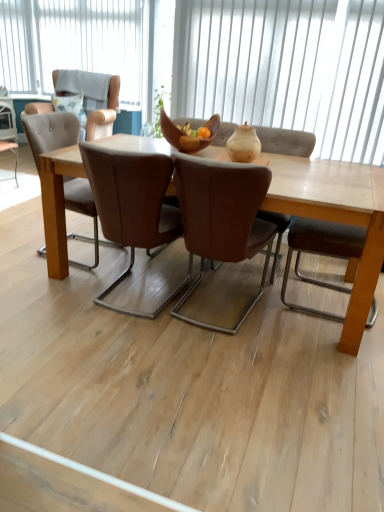
The height and width of the screenshot is (512, 384). Identify the location of vacant area that is in front of light brown wooden table at center. (196, 388).